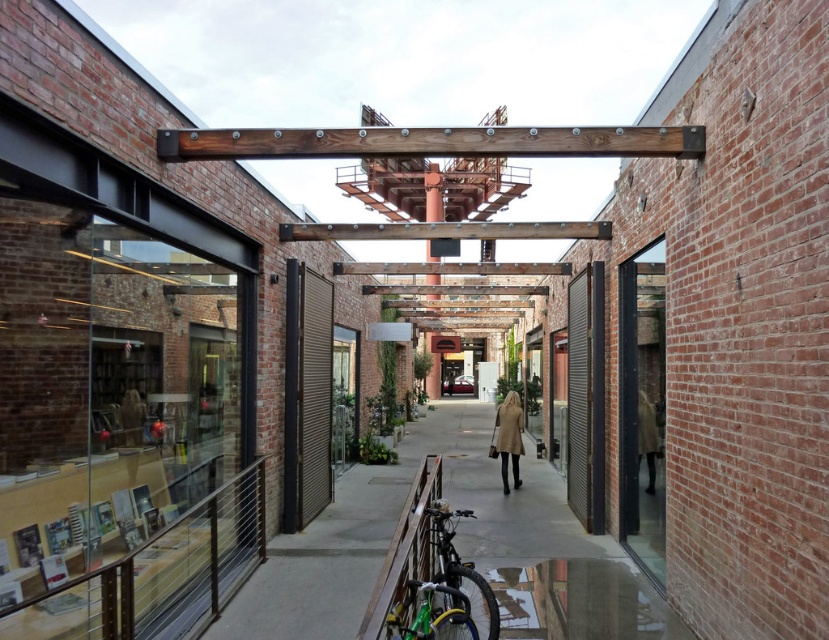
You are a delivery person trying to fit a large package into the space between the beige wool coat at center and the matte beige trench coat at center. Given that the package is 1.2 meters tall, can it fit vertically between them?

The beige wool coat at center is taller than the matte beige trench coat at center. Since the package is 1.2 meters tall, it can only fit vertically if the shorter coat is at least 1.2 meters. However, the description only states the relative height between the two coats, not their absolute measurements. Therefore, we cannot confirm if the package will fit based on the given information.

You are a delivery person trying to navigate through the alley. You see the green matte bicycle at lower center and the beige wool coat at center. Which object is narrower so you can pass between them?

The green matte bicycle at lower center is thinner than the beige wool coat at center, so you can pass through the narrower space between the green matte bicycle at lower center.

In the scene shown: You are a delivery person who needs to maneuver a cart through the alleyway. You see the green matte bicycle at lower center and the matte beige trench coat at center. Which object takes up more space in the alleyway?

The green matte bicycle at lower center takes up more space in the alleyway because it is bigger than the matte beige trench coat at center.